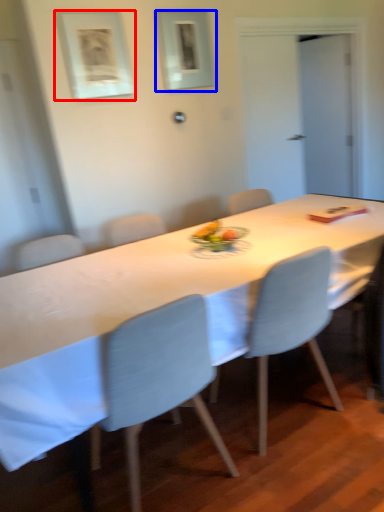
Question: Which of the following is the farthest to the observer, picture frame (highlighted by a red box) or picture frame (highlighted by a blue box)?

Choices:
 (A) picture frame
 (B) picture frame

Answer: (B)